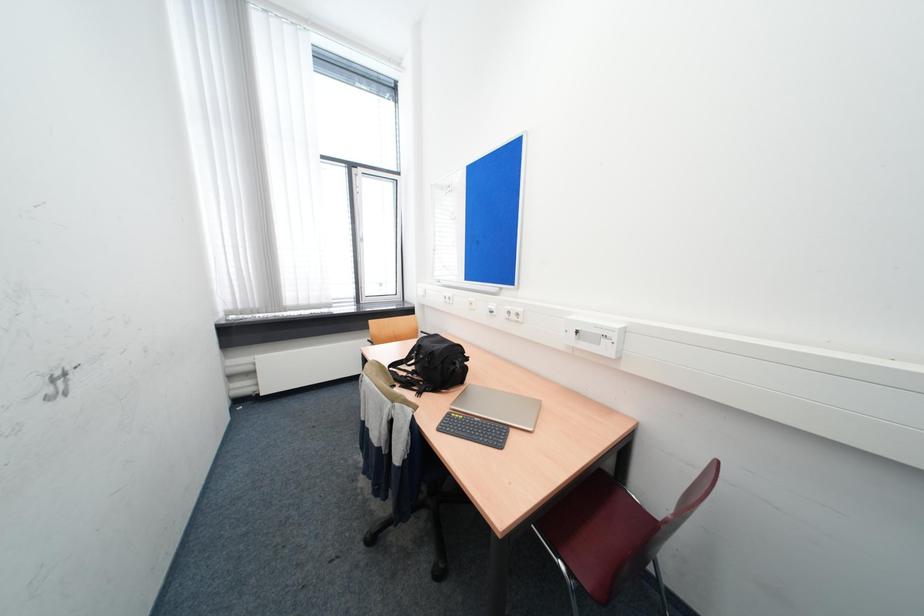
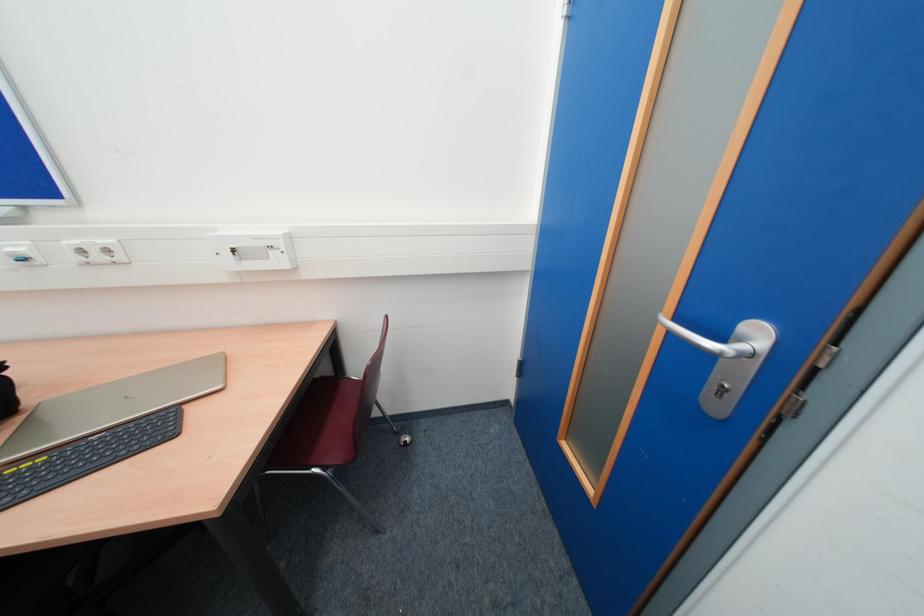
First-person continuous shooting, in which direction is the camera rotating?

The rotation direction of the camera is right-down.